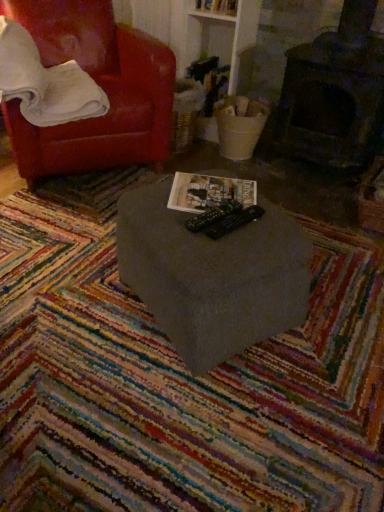
The width and height of the screenshot is (384, 512). What are the coordinates of `vacant area located to the right-hand side of matte gray table at center` in the screenshot? It's located at (338, 309).